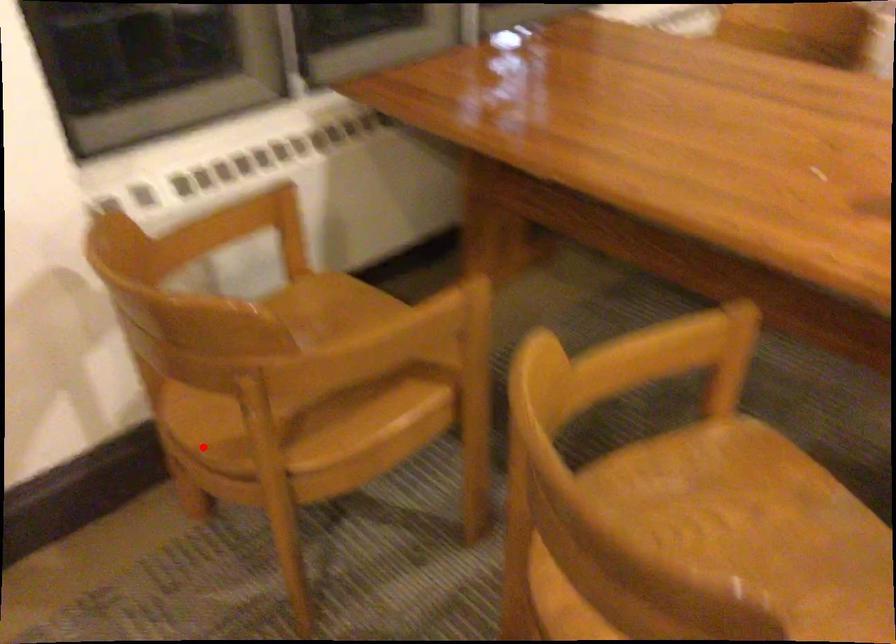
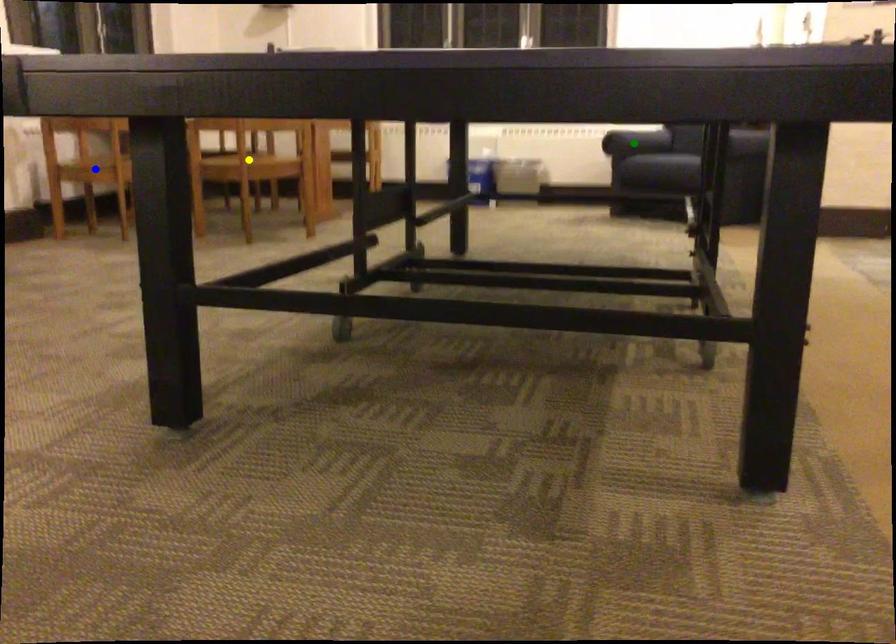
Question: I am providing you with two images of the same scene from different viewpoints. A red point is marked on the first image. You are given multiple points on the second image. Which mark in image 2 goes with the point in image 1?

Choices:
 (A) blue point
 (B) yellow point
 (C) green point

Answer: (A)